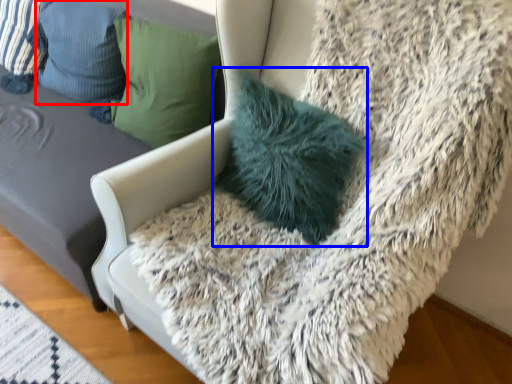
Question: Which object appears farthest to the camera in this image, pillow (highlighted by a red box) or pillow (highlighted by a blue box)?

Choices:
 (A) pillow
 (B) pillow

Answer: (A)